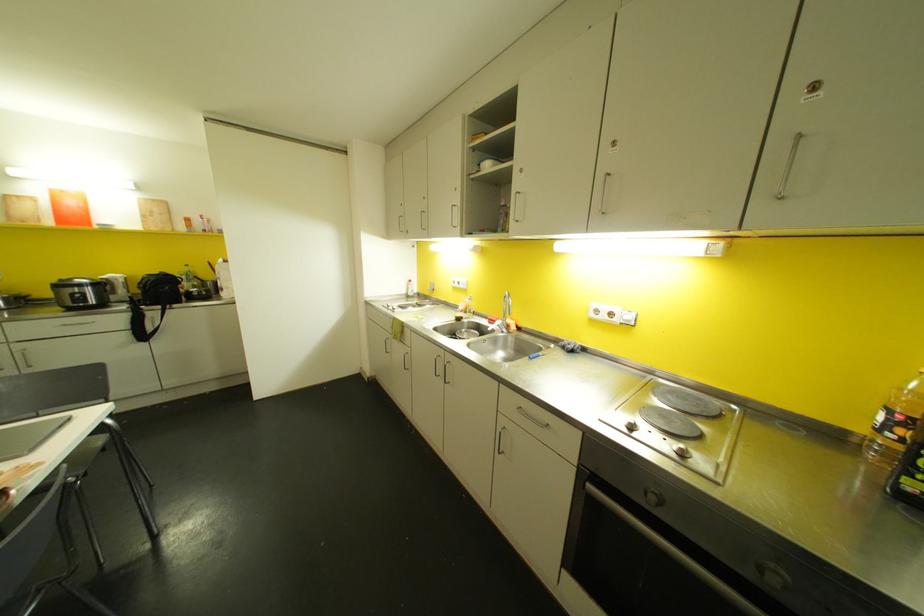
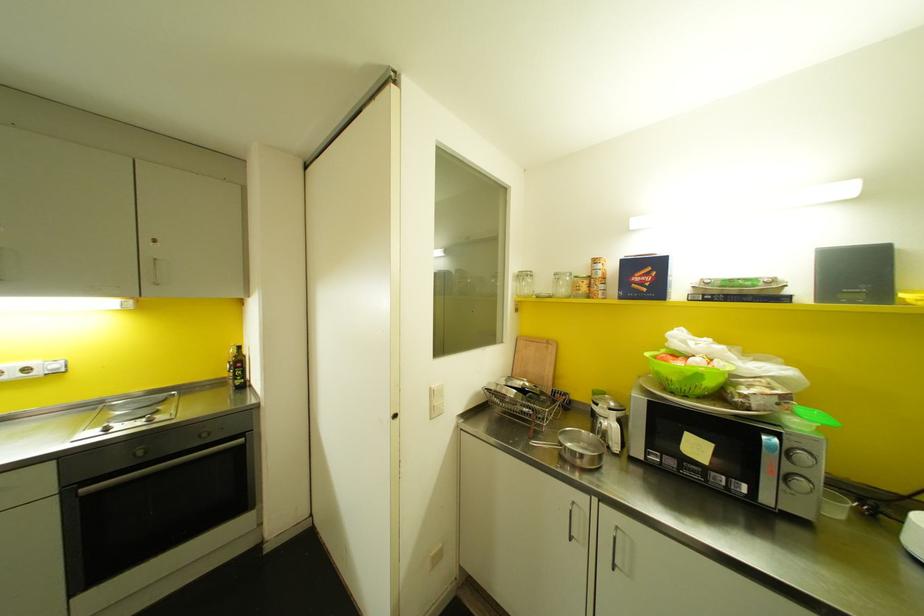
Locate, in the second image, the point that corresponds to [651,498] in the first image.

(140, 451)